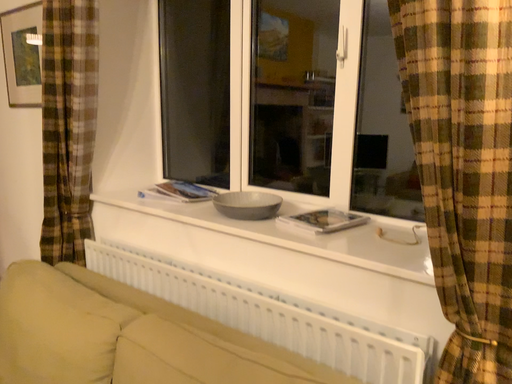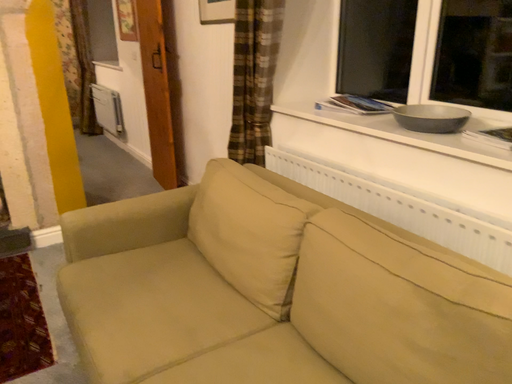
Question: How did the camera likely rotate when shooting the video?

Choices:
 (A) rotated left
 (B) rotated right

Answer: (A)